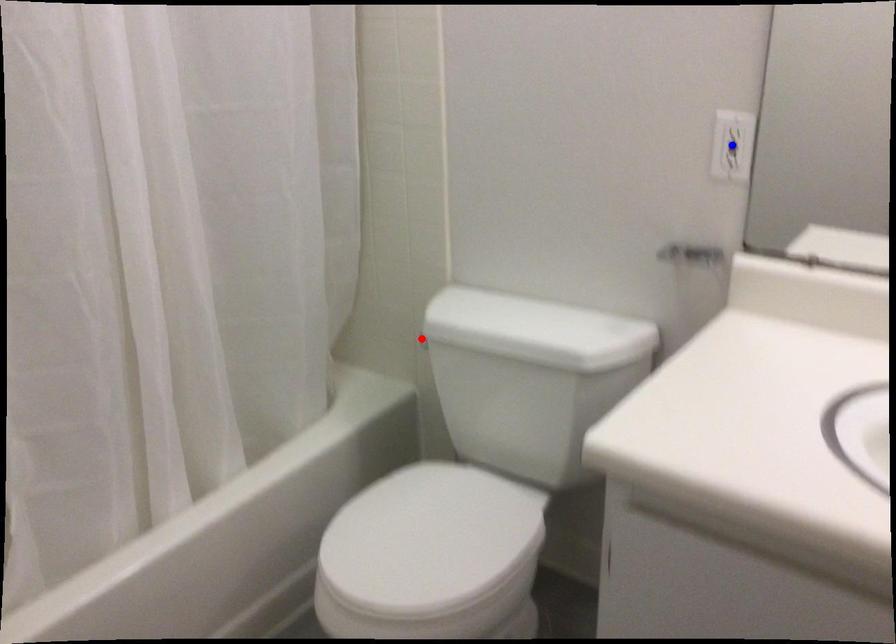
Question: In the image, two points are highlighted. Which point is nearer to the camera? Reply with the corresponding letter.

Choices:
 (A) blue point
 (B) red point

Answer: (A)